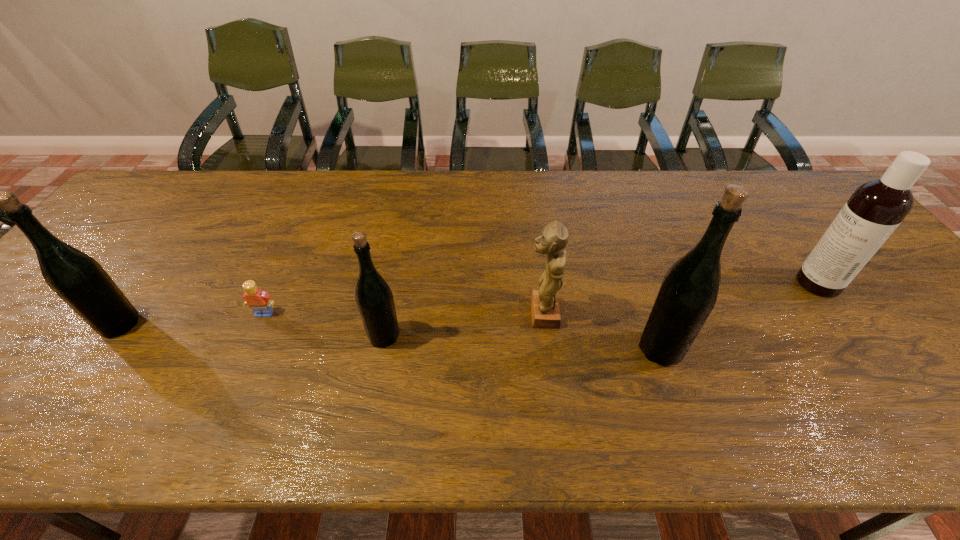
This screenshot has height=540, width=960. In order to click on free space for a new beer bottle on the right in this screenshot , I will do `click(950, 361)`.